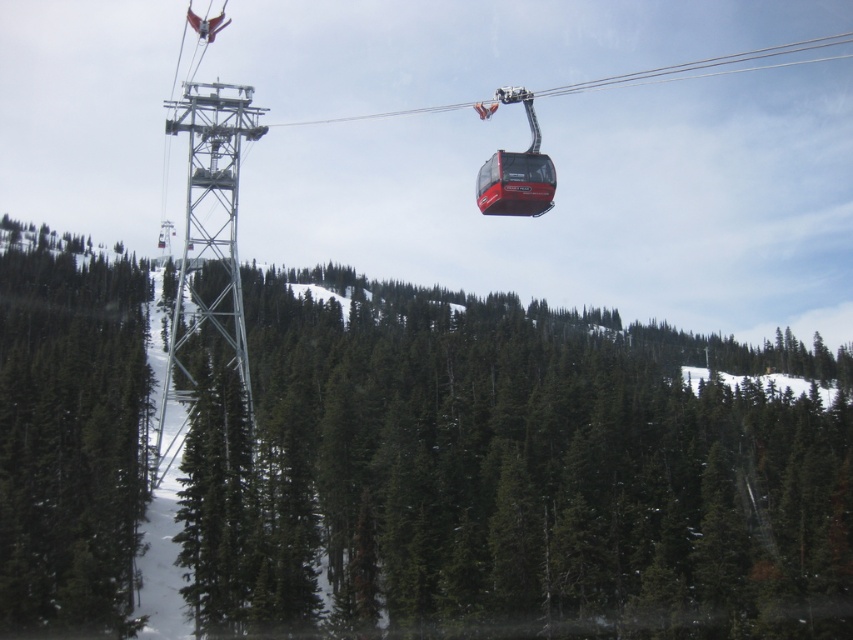
Based on the photo, you are standing at the base of the ski resort looking up towards the gondola lift. You see a point marked at coordinates [511,474]. Based on the scene description, can you identify what object this point is located on?

The point at coordinates [511,474] is located on the green matte tree at center.

You are standing at the base of the ski resort and see two points marked on the slope. The first point is at coordinates point (x=654, y=580) and the second is at point (x=39, y=284). Which point is closer to you?

Point (x=654, y=580) is in front of point (x=39, y=284), so the first point is closer to you.

Consider the image. You are standing at the base of the ski resort and looking up towards the mountains. You notice two green matte trees in your view. Which tree, the green matte tree at center or the green matte tree at left, is closer to you?

The green matte tree at center is closer to you because it is further to the viewer than the green matte tree at left.